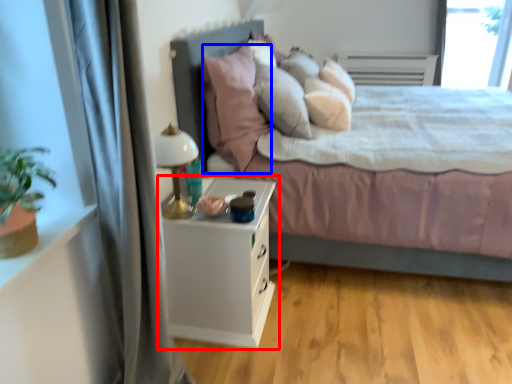
Question: Which point is closer to the camera, nightstand (highlighted by a red box) or pillow (highlighted by a blue box)?

Choices:
 (A) nightstand
 (B) pillow

Answer: (A)